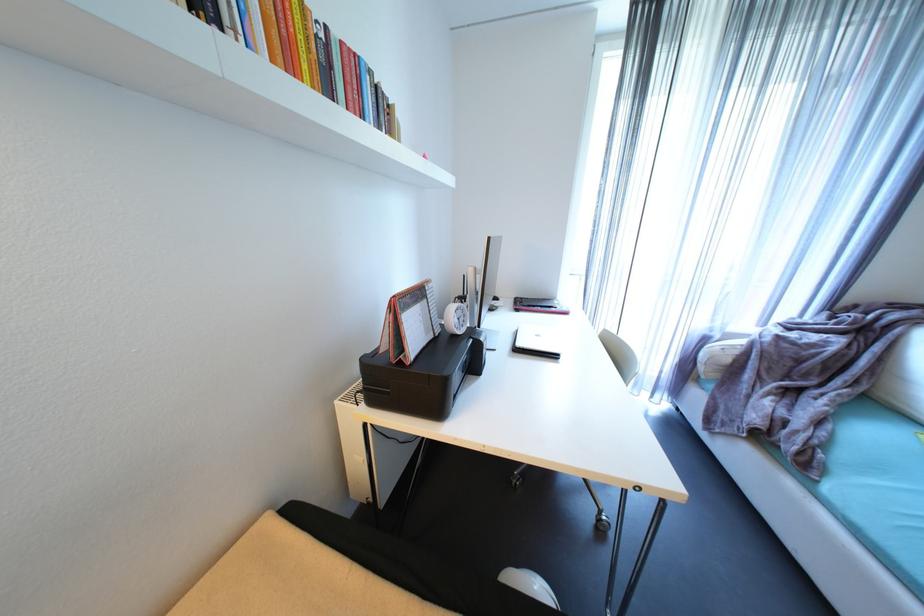
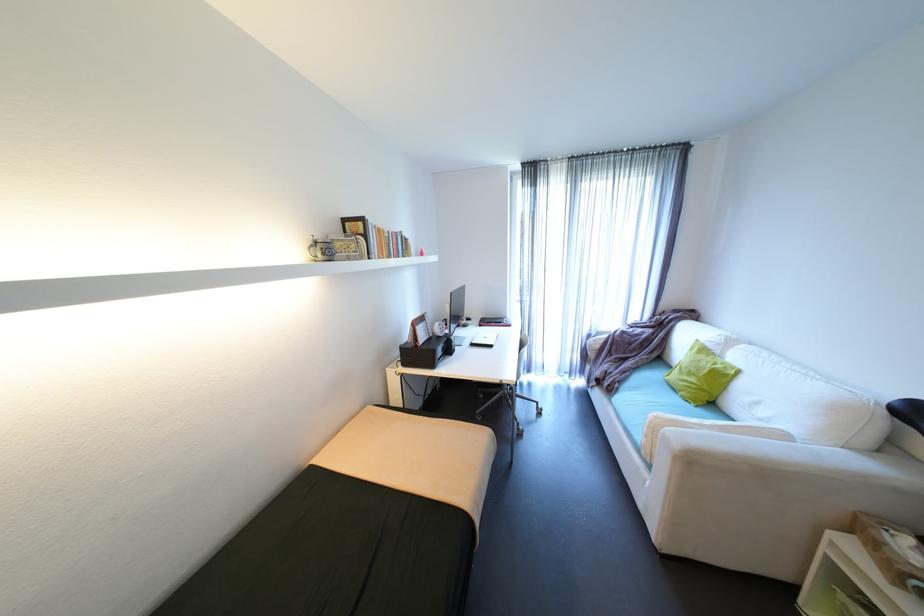
Where in the second image is the point corresponding to the point at 414,307 from the first image?

(426, 323)